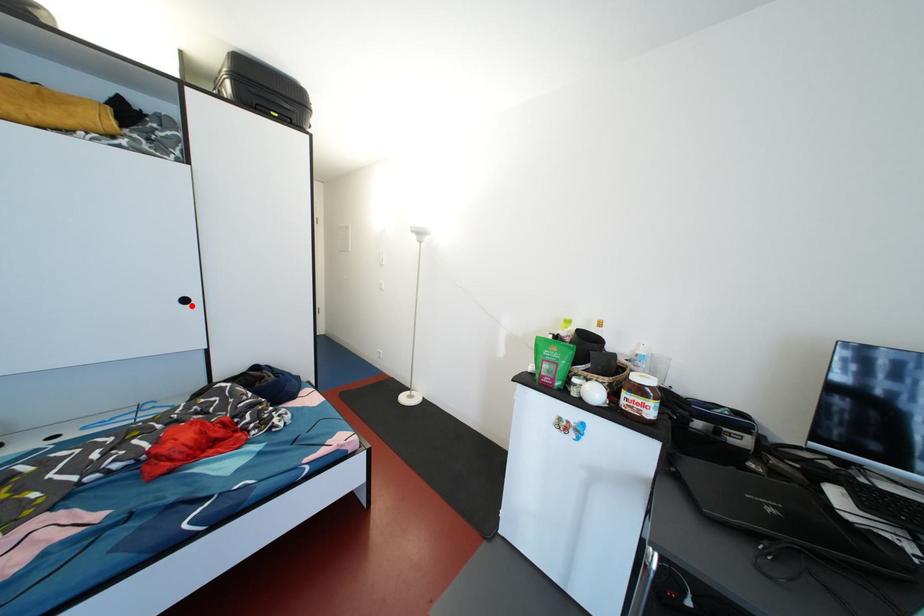
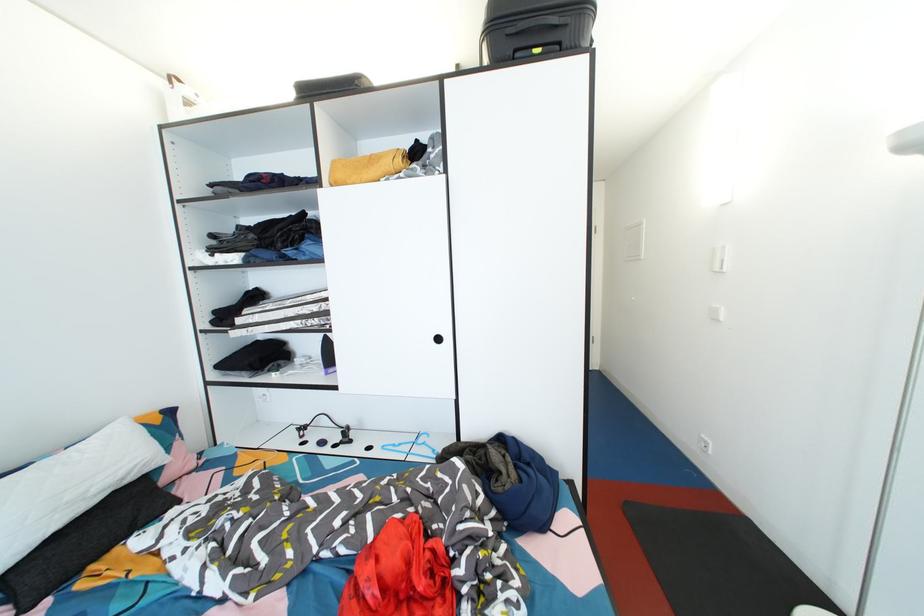
Question: I am providing you with two images of the same scene from different viewpoints. In image1, a red point is highlighted. Considering the same 3D point in image2, which of the following is correct?

Choices:
 (A) It is closer
 (B) It is farther

Answer: (A)